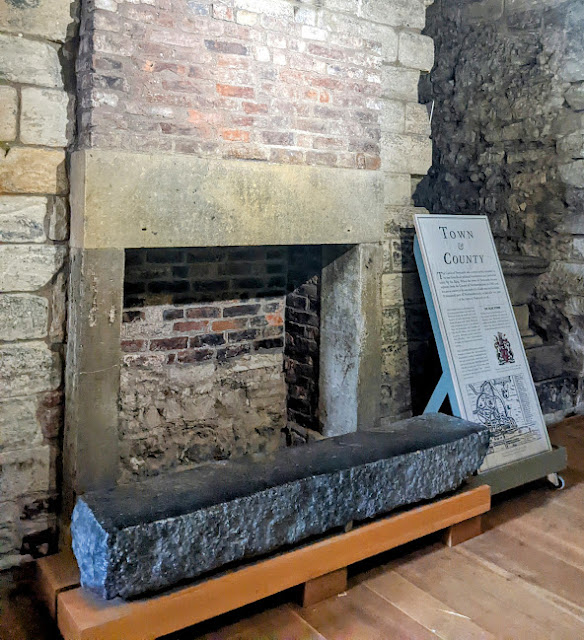
Find the location of a particular element. The image size is (584, 640). fireplace left wall is located at coordinates (303, 331).